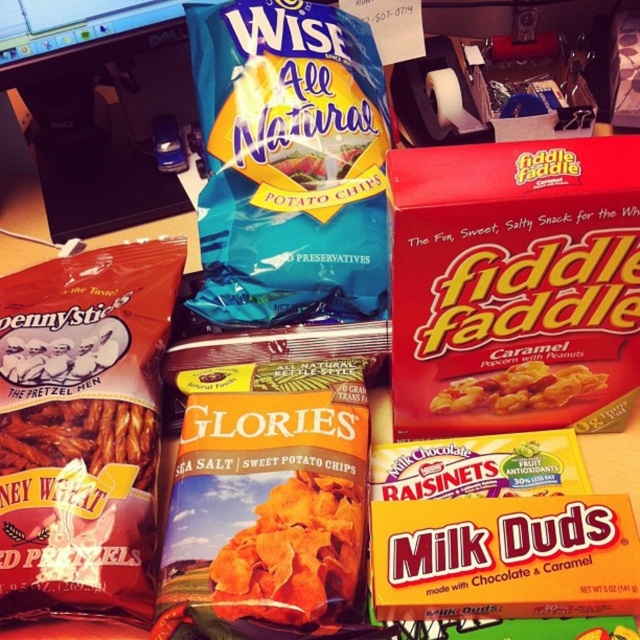
The image size is (640, 640). In order to click on red cardboard box at upper right in this screenshot , I will do `click(515, 285)`.

Does point (589, 173) come closer to viewer compared to point (589, 394)?

That is True.

Is point (600, 173) positioned before point (522, 376)?

Yes, point (600, 173) is in front of point (522, 376).

Locate an element on the screen. red cardboard box at upper right is located at coordinates (515, 285).